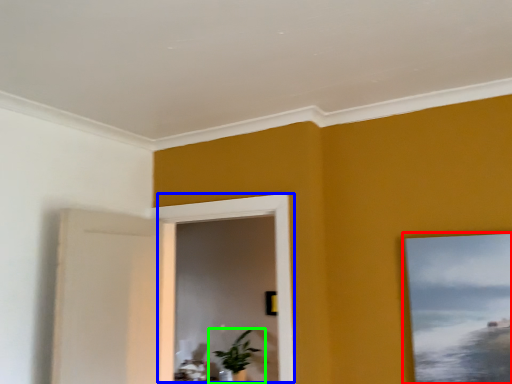
Question: Which object is positioned closest to picture frame (highlighted by a red box)? Select from window (highlighted by a blue box) and houseplant (highlighted by a green box).

Choices:
 (A) window
 (B) houseplant

Answer: (A)